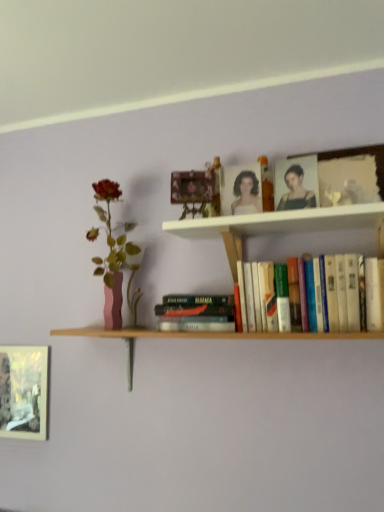
Question: Is hardcover books at center, the second book in the left-to-right sequence, bigger than hardcover book at center, the second book in the right-to-left sequence?

Choices:
 (A) no
 (B) yes

Answer: (B)

Question: From a real-world perspective, does hardcover books at center, the second book in the left-to-right sequence, sit lower than hardcover book at center, acting as the 1th book starting from the left?

Choices:
 (A) yes
 (B) no

Answer: (B)

Question: Does hardcover books at center, the second book in the left-to-right sequence, have a greater width compared to hardcover book at center, the second book in the right-to-left sequence?

Choices:
 (A) no
 (B) yes

Answer: (B)

Question: Is hardcover books at center, the first book from the right, in front of hardcover book at center, acting as the 1th book starting from the left?

Choices:
 (A) yes
 (B) no

Answer: (A)

Question: Would you say hardcover books at center, the second book in the left-to-right sequence, is outside hardcover book at center, the second book in the right-to-left sequence?

Choices:
 (A) yes
 (B) no

Answer: (A)

Question: Considering the relative positions of hardcover books at center, the second book in the left-to-right sequence, and hardcover book at center, the second book in the right-to-left sequence, in the image provided, is hardcover books at center, the second book in the left-to-right sequence, to the left of hardcover book at center, the second book in the right-to-left sequence, from the viewer's perspective?

Choices:
 (A) yes
 (B) no

Answer: (B)

Question: Considering the relative sizes of matte pink vase at left and metallic silver frame at lower left, which is counted as the 2th picture frame, starting from the right, in the image provided, is matte pink vase at left shorter than metallic silver frame at lower left, which is counted as the 2th picture frame, starting from the right,?

Choices:
 (A) no
 (B) yes

Answer: (A)

Question: Is there a large distance between matte pink vase at left and metallic silver frame at lower left, which is counted as the 2th picture frame, starting from the front?

Choices:
 (A) no
 (B) yes

Answer: (A)

Question: Does matte pink vase at left appear on the right side of metallic silver frame at lower left, the first picture frame viewed from the back?

Choices:
 (A) no
 (B) yes

Answer: (B)

Question: From a real-world perspective, is matte pink vase at left physically above metallic silver frame at lower left, the first picture frame from the left?

Choices:
 (A) no
 (B) yes

Answer: (B)

Question: Could you tell me if matte pink vase at left is turned towards metallic silver frame at lower left, the first picture frame from the left?

Choices:
 (A) yes
 (B) no

Answer: (B)

Question: From the image's perspective, is matte pink vase at left located above metallic silver frame at lower left, which is counted as the 2th picture frame, starting from the right?

Choices:
 (A) yes
 (B) no

Answer: (A)

Question: Is white wooden shelf at upper center positioned far away from matte pink vase at left?

Choices:
 (A) no
 (B) yes

Answer: (A)